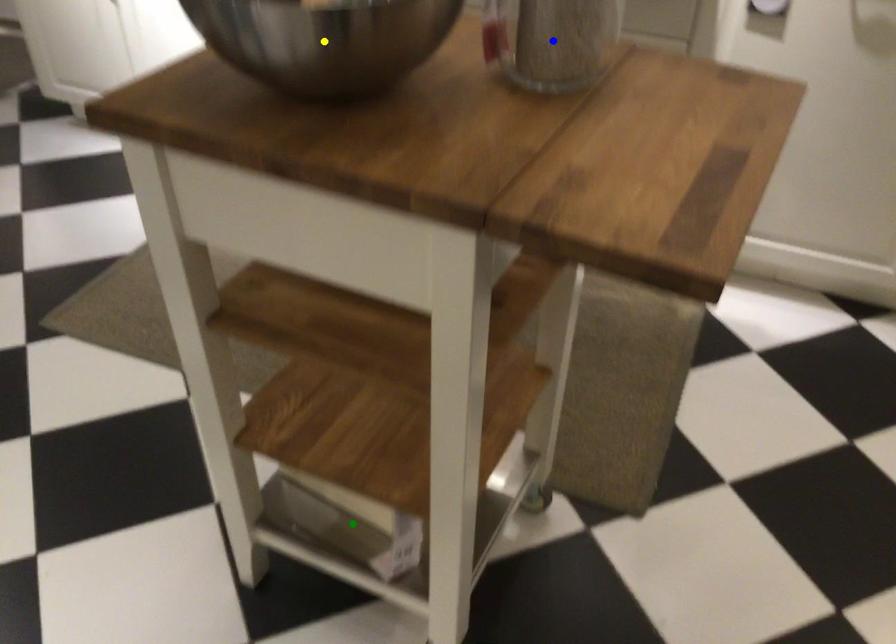
Order these from nearest to farthest:
A) blue point
B) yellow point
C) green point

yellow point, green point, blue point